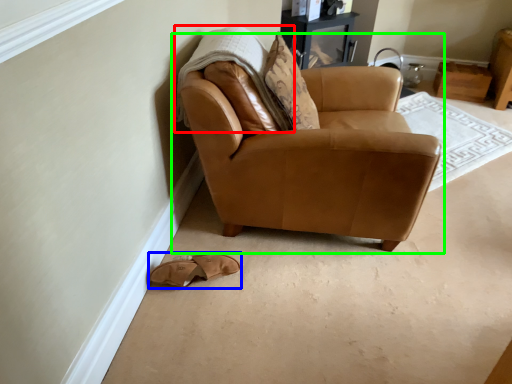
Question: Estimate the real-world distances between objects in this image. Which object is farther from blanket (highlighted by a red box), footwear (highlighted by a blue box) or chair (highlighted by a green box)?

Choices:
 (A) footwear
 (B) chair

Answer: (A)